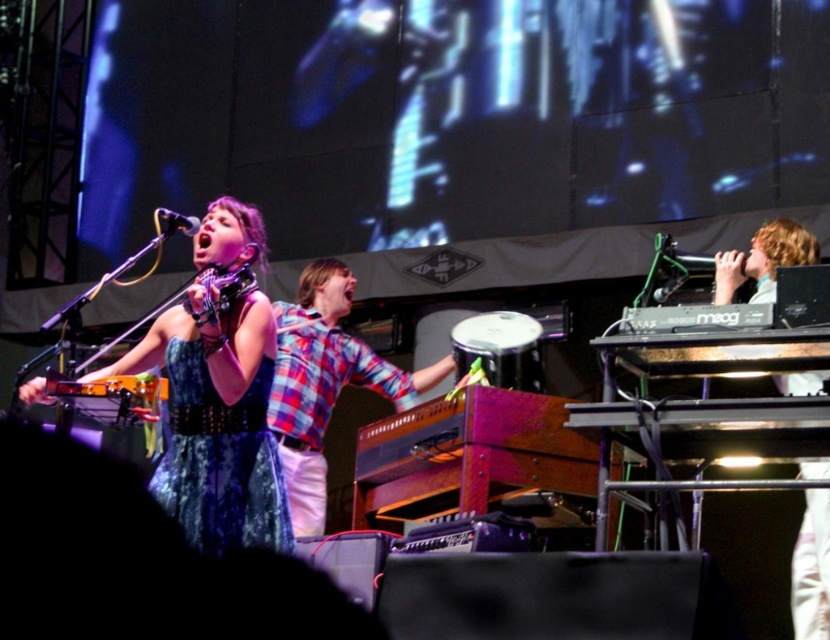
Question: Which of these objects is positioned closest to the matte black microphone at upper left?

Choices:
 (A) denim dress at left
 (B) shiny blue dress at left
 (C) light brown wooden keyboard at right
 (D) plaid fabric shirt at center

Answer: (A)

Question: Which point is farther to the camera?

Choices:
 (A) denim dress at left
 (B) matte black microphone at upper left
 (C) plaid fabric shirt at center

Answer: (C)

Question: Is plaid fabric shirt at center smaller than matte black microphone at upper left?

Choices:
 (A) no
 (B) yes

Answer: (B)

Question: Which point is closer to the camera?

Choices:
 (A) shiny blue dress at left
 (B) plaid fabric shirt at center
 (C) matte black microphone at upper left
 (D) light brown wooden keyboard at right

Answer: (A)

Question: Is shiny blue dress at left bigger than light brown wooden keyboard at right?

Choices:
 (A) no
 (B) yes

Answer: (B)

Question: Is shiny blue dress at left in front of matte black microphone at upper left?

Choices:
 (A) yes
 (B) no

Answer: (A)